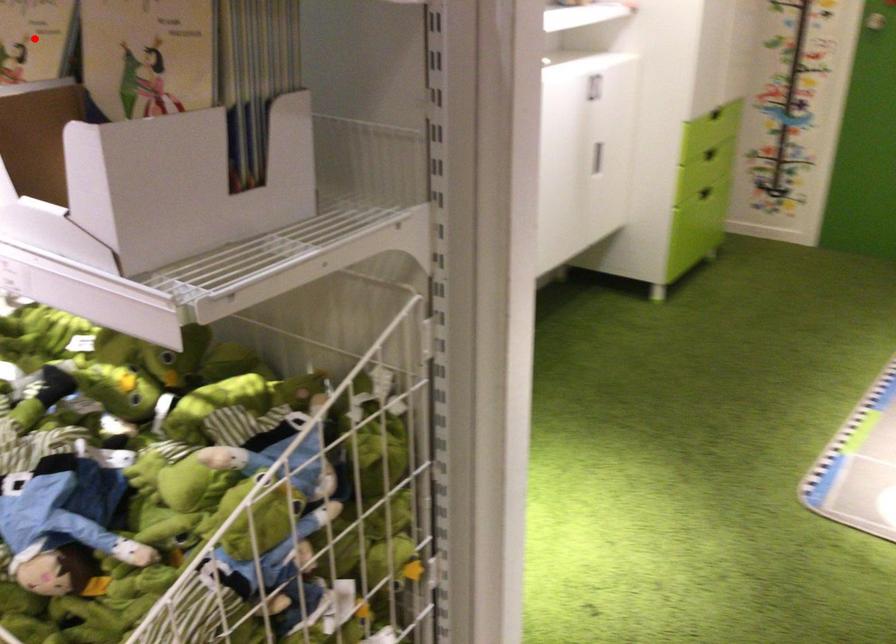
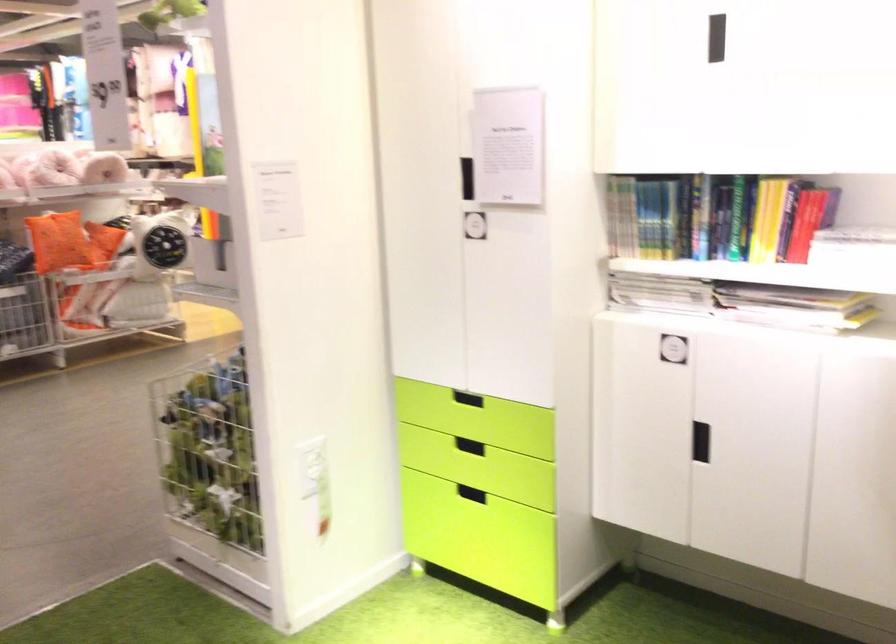
Question: I am providing you with two images of the same scene from different viewpoints. A red point is marked on the first image. Is the red point's position out of view in image 2?

Choices:
 (A) Yes
 (B) No

Answer: (A)